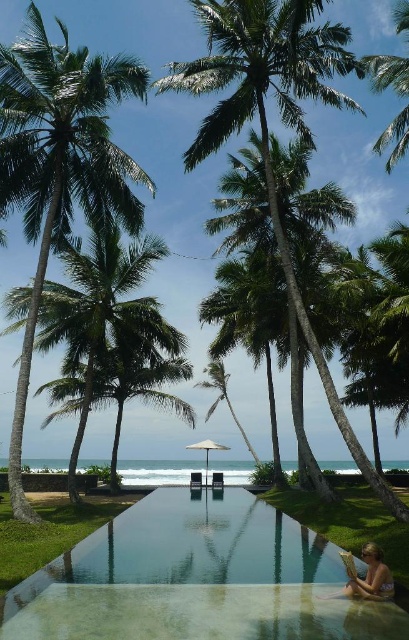
Question: Does green leafy palm tree at left have a smaller size compared to green leafy palm tree at upper center?

Choices:
 (A) yes
 (B) no

Answer: (B)

Question: Can you confirm if green leafy palm tree at left is positioned to the left of green leafy palm tree at upper center?

Choices:
 (A) yes
 (B) no

Answer: (A)

Question: Which point is closer to the camera?

Choices:
 (A) tan skin person at lower right
 (B) clear glass pool at center

Answer: (B)

Question: Which object appears closest to the camera in this image?

Choices:
 (A) green leafy palm tree at left
 (B) clear glass pool at center

Answer: (B)

Question: Based on their relative distances, which object is nearer to the clear glass pool at center?

Choices:
 (A) green leafy palm tree at left
 (B) green leafy palm tree at upper center

Answer: (A)

Question: From the image, what is the correct spatial relationship of green leafy palm tree at center in relation to green leafy palm tree at upper center?

Choices:
 (A) below
 (B) above

Answer: (A)